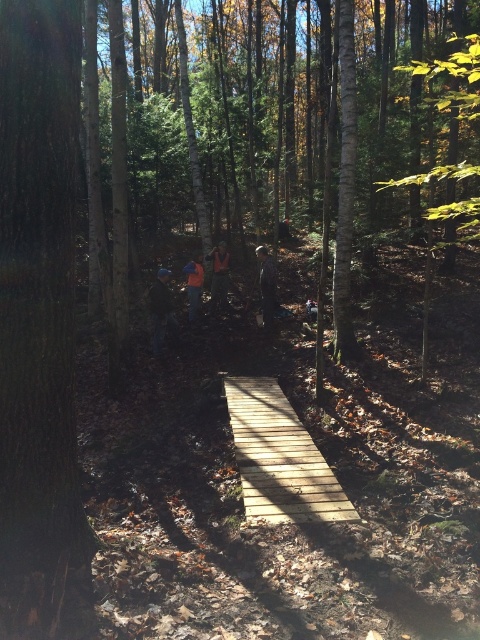
You are a hiker who has just spotted a brown rough bark at left and a dark blue fabric jacket at center in the forest. Which object is closer to the ground?

The brown rough bark at left is closer to the ground since it is positioned below the dark blue fabric jacket at center.

You are standing on the wooden bridge in the forest and notice an orange fabric ahead. Based on the scene, can you determine if the orange fabric at center is closer to you or farther away than the light brown wooden bridge at center?

The light brown wooden bridge at center is closer to the viewer than the orange fabric at center, so the orange fabric at center is farther away.